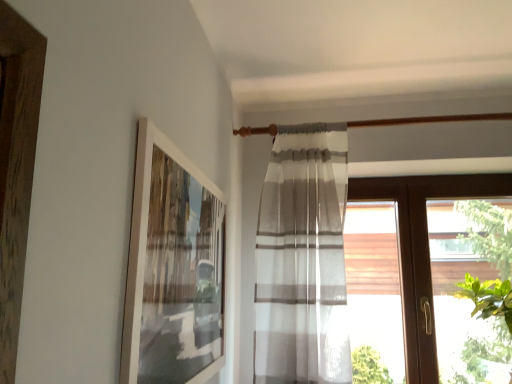
Question: From the image's perspective, does brown wood window at right appear lower than white matte picture frame at upper left?

Choices:
 (A) no
 (B) yes

Answer: (B)

Question: Is brown wood window at right positioned before white matte picture frame at upper left?

Choices:
 (A) yes
 (B) no

Answer: (B)

Question: Is brown wood window at right facing away from white matte picture frame at upper left?

Choices:
 (A) no
 (B) yes

Answer: (A)

Question: Considering the relative sizes of brown wood window at right and white matte picture frame at upper left in the image provided, is brown wood window at right thinner than white matte picture frame at upper left?

Choices:
 (A) yes
 (B) no

Answer: (B)

Question: Is brown wood window at right taller than white matte picture frame at upper left?

Choices:
 (A) yes
 (B) no

Answer: (A)

Question: Considering the positions of brown wood window at right and white matte picture frame at upper left in the image, is brown wood window at right taller or shorter than white matte picture frame at upper left?

Choices:
 (A) short
 (B) tall

Answer: (B)

Question: From a real-world perspective, relative to white matte picture frame at upper left, is brown wood window at right vertically above or below?

Choices:
 (A) above
 (B) below

Answer: (B)

Question: In terms of size, does brown wood window at right appear bigger or smaller than white matte picture frame at upper left?

Choices:
 (A) big
 (B) small

Answer: (A)

Question: In the image, is brown wood window at right on the left side or the right side of white matte picture frame at upper left?

Choices:
 (A) right
 (B) left

Answer: (A)

Question: Is white matte picture frame at upper left inside the boundaries of brown wood window at right, or outside?

Choices:
 (A) inside
 (B) outside

Answer: (B)

Question: Relative to brown wood window at right, is white matte picture frame at upper left in front or behind?

Choices:
 (A) front
 (B) behind

Answer: (A)

Question: From the image's perspective, relative to brown wood window at right, is white matte picture frame at upper left above or below?

Choices:
 (A) above
 (B) below

Answer: (A)

Question: Considering the positions of white matte picture frame at upper left and brown wood window at right in the image, is white matte picture frame at upper left taller or shorter than brown wood window at right?

Choices:
 (A) tall
 (B) short

Answer: (B)

Question: Is point (445, 188) positioned closer to the camera than point (466, 223)?

Choices:
 (A) closer
 (B) farther

Answer: (A)

Question: From their relative heights in the image, would you say brown wood window at right is taller or shorter than green leafy plant at right?

Choices:
 (A) tall
 (B) short

Answer: (A)